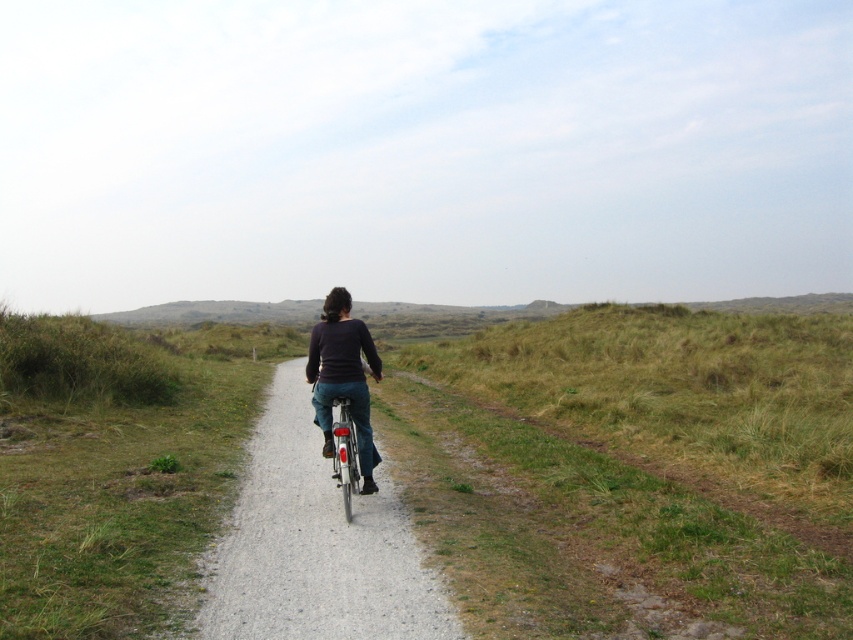
Question: Which object appears farthest from the camera in this image?

Choices:
 (A) matte black bicycle at center
 (B) shiny silver bicycle at center
 (C) green grassy at right

Answer: (B)

Question: Is green grassy at right above shiny silver bicycle at center?

Choices:
 (A) no
 (B) yes

Answer: (B)

Question: Which of these objects is positioned farthest from the matte black bicycle at center?

Choices:
 (A) shiny silver bicycle at center
 (B) green grassy at right

Answer: (B)

Question: Is matte black bicycle at center in front of shiny silver bicycle at center?

Choices:
 (A) no
 (B) yes

Answer: (B)

Question: Which point appears closest to the camera in this image?

Choices:
 (A) (335, 529)
 (B) (556, 577)

Answer: (B)

Question: Is matte black bicycle at center to the right of shiny silver bicycle at center from the viewer's perspective?

Choices:
 (A) yes
 (B) no

Answer: (B)